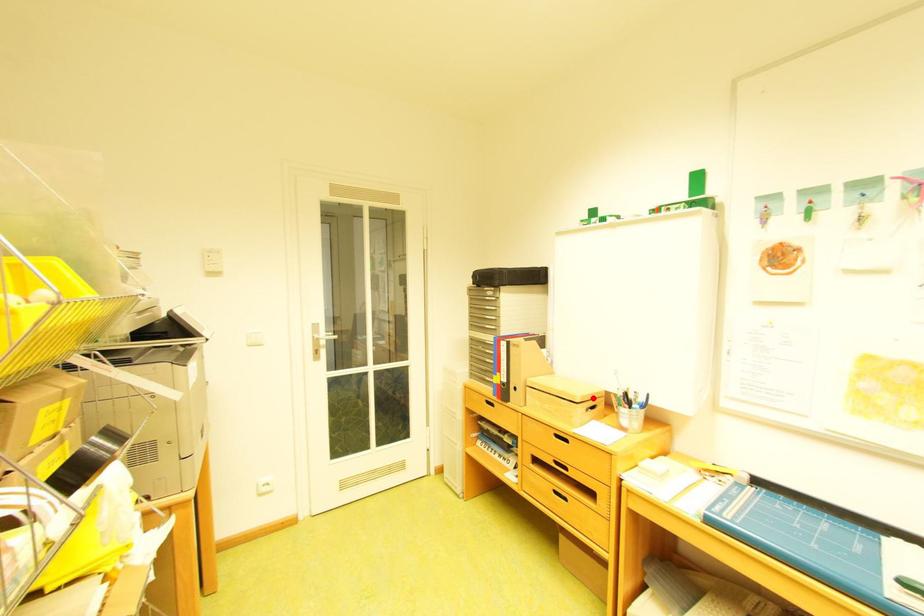
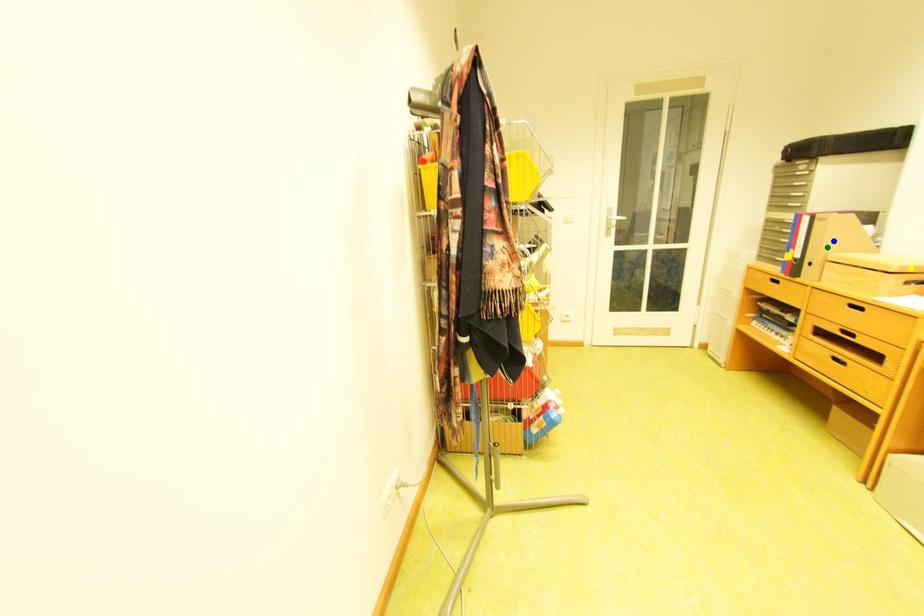
Question: I am providing you with two images of the same scene from different viewpoints. A red point is marked on the first image. You are given multiple points on the second image. Which point in image 2 is actually the same real-world point as the red point in image 1?

Choices:
 (A) yellow point
 (B) green point
 (C) blue point

Answer: (A)